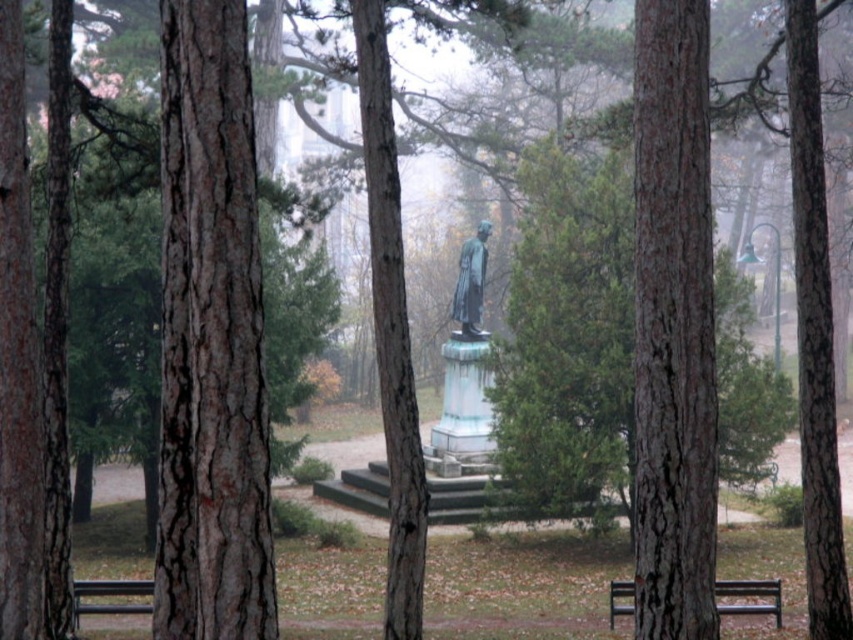
You are a visitor in the park and want to sit on the black metal bench at lower left. Are you able to see the smooth brown bark at center from your seated position on the bench?

The smooth brown bark at center is in front of the black metal bench at lower left, so when sitting on the bench, you would be facing towards the bark and can see it.

You are a park visitor who wants to place a 3 meter long bench between the brown rough bark tree trunk at left and the smooth brown bark at center. Is there enough space for the bench?

The distance between the brown rough bark tree trunk at left and the smooth brown bark at center is 2.63 meters. Since the bench is 3 meters long, it will not fit in the available space.

You are a park visitor who wants to sit on the black metal bench at lower left. However, you notice the brown rough bark tree trunk at left is blocking your view of the statue. Is the tree trunk taller than the bench?

The brown rough bark tree trunk at left is taller than the black metal bench at lower left, so yes, the tree trunk is taller than the bench.